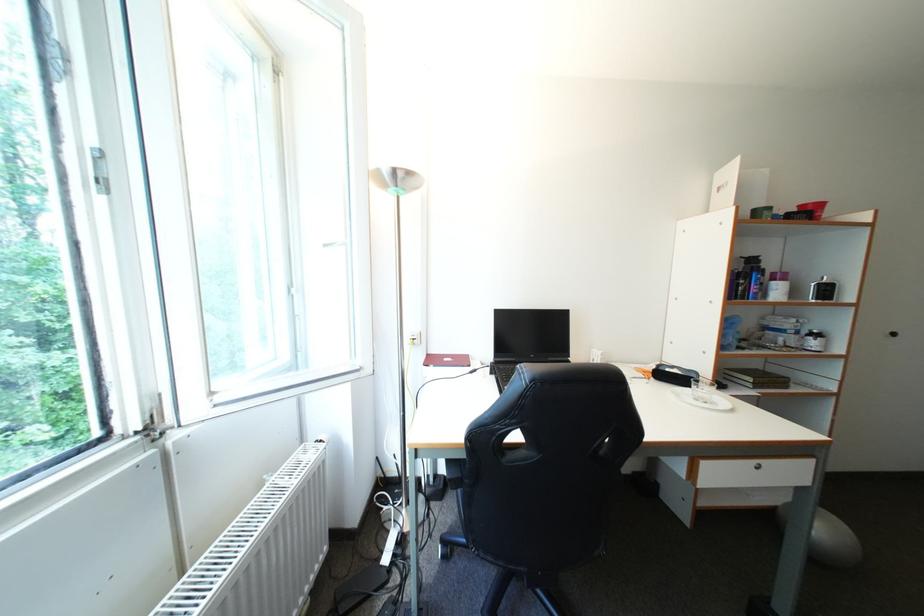
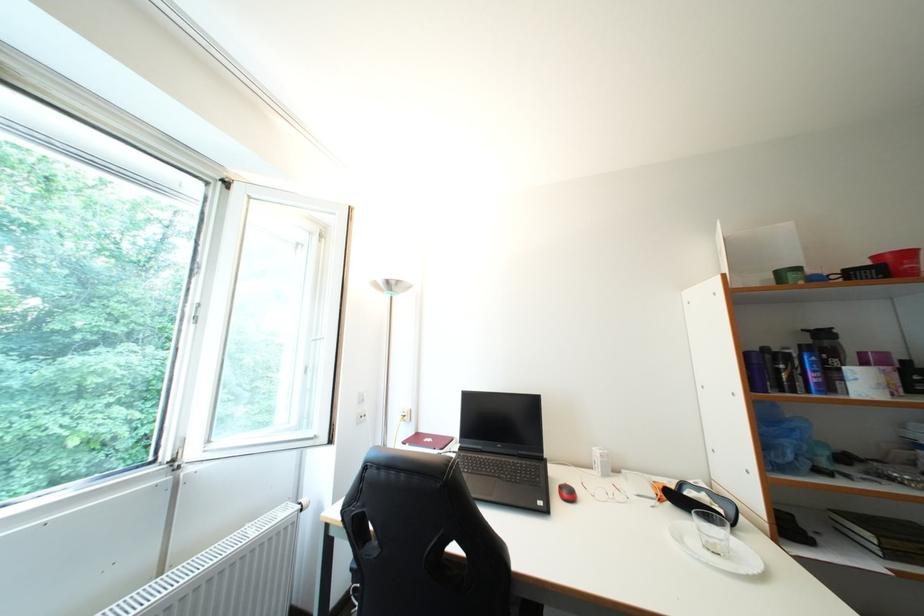
Question: Which direction would the cameraman need to move to produce the second image? Reply with the corresponding letter.

Choices:
 (A) Left
 (B) Right
 (C) Forward
 (D) Backward

Answer: (B)